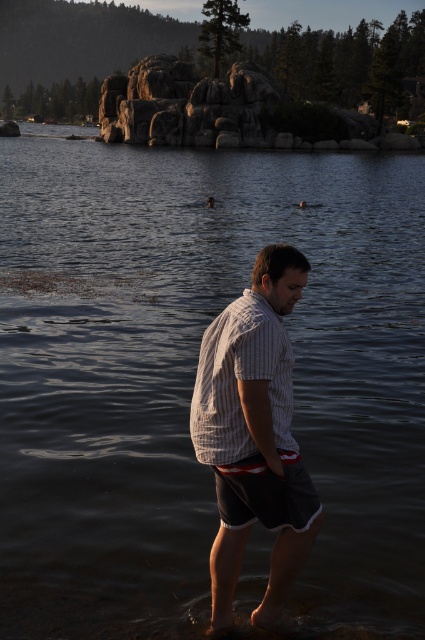
You are a photographer trying to capture the man in the white striped shirt at center and dark gray cotton shorts at center. If you want to focus on the shirt first, which object should you adjust your camera to prioritize?

The white striped shirt at center is in front of the dark gray cotton shorts at center, so you should adjust your camera to prioritize focusing on the white striped shirt at center first.